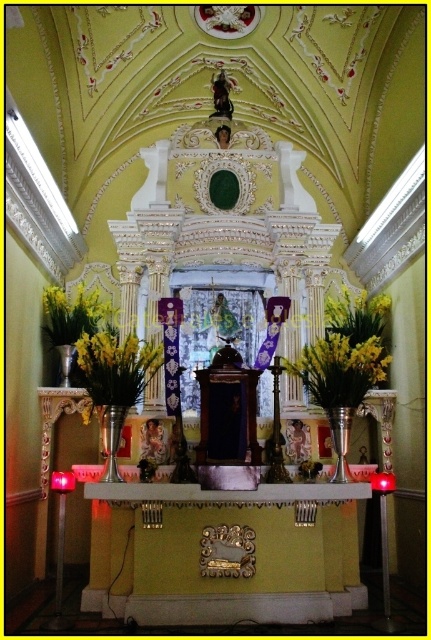
Question: Among these points, which one is nearest to the camera?

Choices:
 (A) (361, 346)
 (B) (337, 298)
 (C) (87, 371)

Answer: (C)

Question: Does yellow matte flowers at center appear on the left side of yellow matte vase at center?

Choices:
 (A) yes
 (B) no

Answer: (B)

Question: Does yellow artificial flowers at center lie behind yellow matte vase at center?

Choices:
 (A) yes
 (B) no

Answer: (A)

Question: Which of these objects is positioned farthest from the yellow artificial flowers at center?

Choices:
 (A) yellow matte flowers at center
 (B) yellow matte vase at center

Answer: (B)

Question: Is yellow matte flowers at center thinner than yellow matte vase at center?

Choices:
 (A) yes
 (B) no

Answer: (B)

Question: Considering the real-world distances, which object is farthest from the yellow artificial flowers at center?

Choices:
 (A) yellow matte vase at center
 (B) yellow matte flowers at center

Answer: (A)